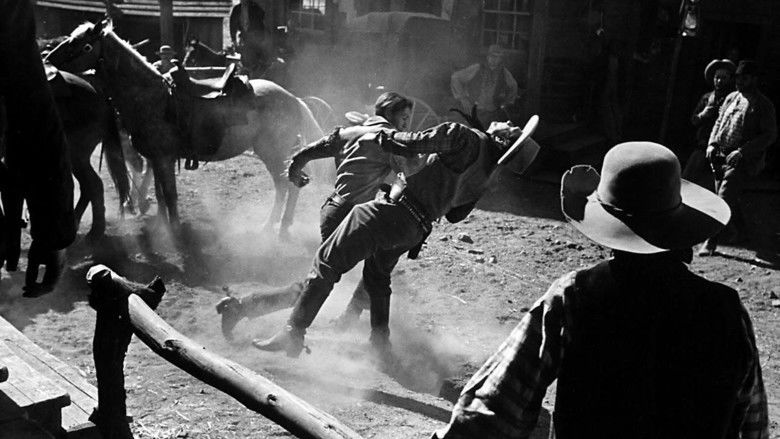
You are a GUI agent. You are given a task and a screenshot of the screen. Output one action in this format:
    pyautogui.click(x=<x>, y=<y>)
    Task: Click on the wood post
    
    Given the screenshot: What is the action you would take?
    pyautogui.click(x=165, y=328), pyautogui.click(x=101, y=361)